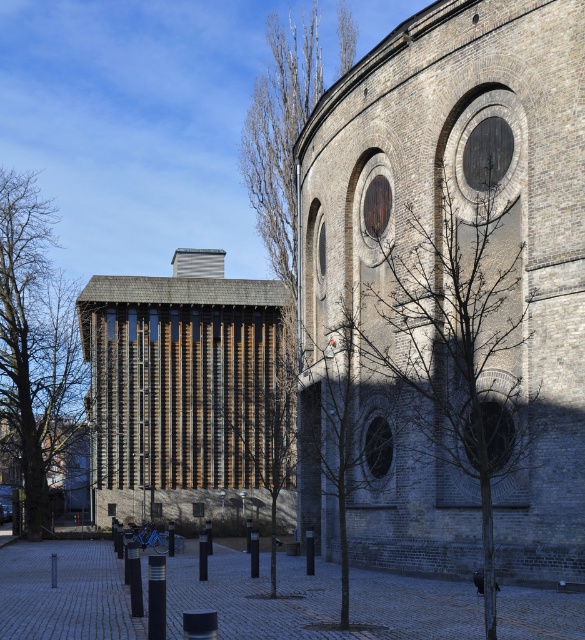
Question: Can you confirm if wooden slats at center is positioned to the right of bare branches at upper center?

Choices:
 (A) no
 (B) yes

Answer: (A)

Question: Can you confirm if bare branches at center is bigger than bare branches at upper center?

Choices:
 (A) yes
 (B) no

Answer: (B)

Question: Does wooden slats at center have a larger size compared to brown textured tree at left?

Choices:
 (A) no
 (B) yes

Answer: (A)

Question: Among these objects, which one is farthest from the camera?

Choices:
 (A) bare branches at upper center
 (B) green leafy tree at center

Answer: (A)

Question: Which of the following is the farthest from the observer?

Choices:
 (A) (221, 298)
 (B) (32, 472)
 (C) (273, 448)
 (D) (285, 272)

Answer: (A)

Question: Which point is farther to the camera?

Choices:
 (A) coord(53,381)
 (B) coord(435,438)
 (C) coord(308,86)
 (D) coord(252,458)

Answer: (A)